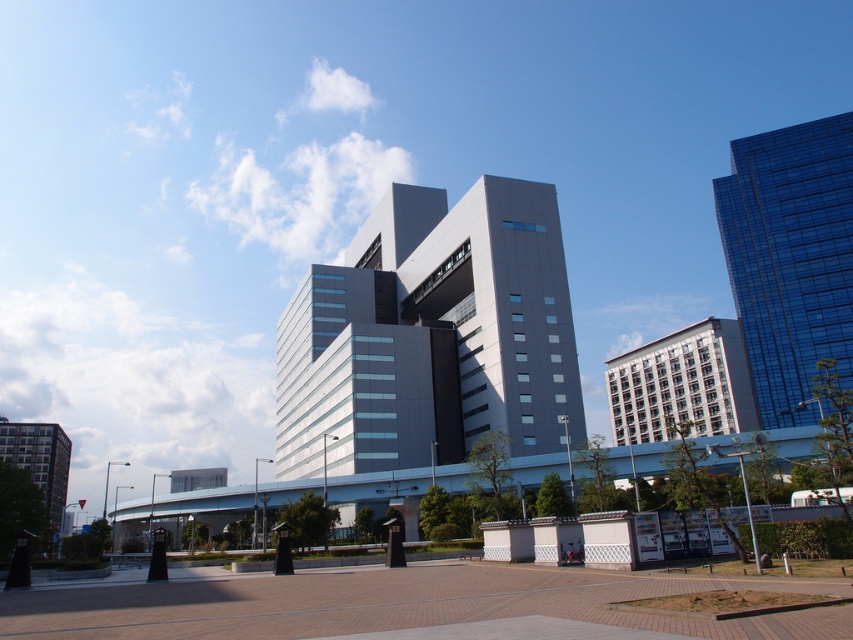
Question: Is sleek gray building at center positioned before matte gray building at lower left?

Choices:
 (A) no
 (B) yes

Answer: (A)

Question: Which point is farther from the camera taking this photo?

Choices:
 (A) (485, 212)
 (B) (59, 435)

Answer: (B)

Question: Can you confirm if shiny glass building at upper right is thinner than matte gray building at lower left?

Choices:
 (A) no
 (B) yes

Answer: (B)

Question: Is shiny glass building at upper right thinner than matte gray building at lower left?

Choices:
 (A) yes
 (B) no

Answer: (A)

Question: Which point is farther to the camera?

Choices:
 (A) (331, 305)
 (B) (3, 419)

Answer: (B)

Question: Which object is the closest to the matte gray building at lower left?

Choices:
 (A) shiny glass building at upper right
 (B) sleek gray building at center

Answer: (B)